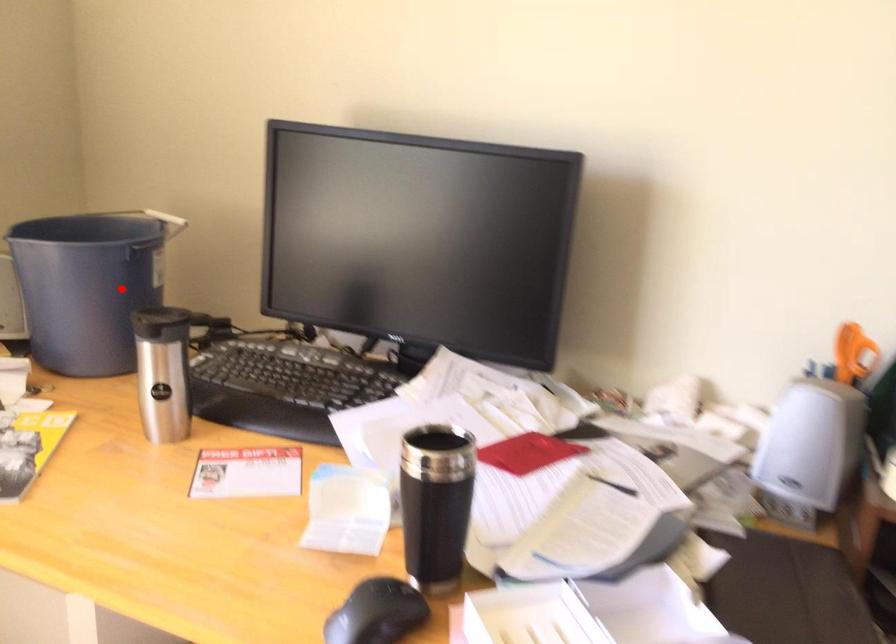
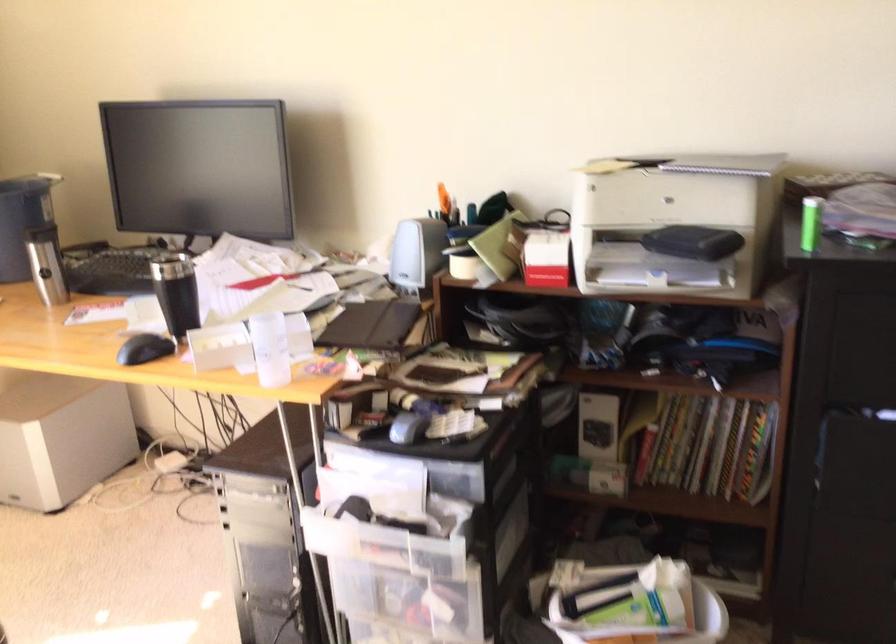
Question: A red point is marked in image1. In image2, is the corresponding 3D point closer to the camera or farther? Reply with the corresponding letter.

Choices:
 (A) The corresponding 3D point is closer.
 (B) The corresponding 3D point is farther.

Answer: (B)